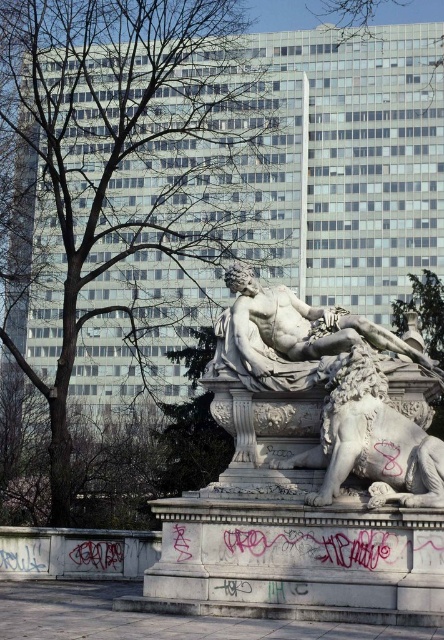
In the scene shown: Is the position of green leafy tree at center more distant than that of white marble statue at center?

Yes, it is behind white marble statue at center.

Who is positioned more to the right, green leafy tree at center or white marble statue at center?

From the viewer's perspective, white marble statue at center appears more on the right side.

Does point (95, 68) lie in front of point (289, 353)?

No, it is not.

Find the location of a particular element. green leafy tree at center is located at coordinates (127, 184).

Does white marble lion at lower center have a greater width compared to white marble statue at center?

Incorrect, white marble lion at lower center's width does not surpass white marble statue at center's.

In the scene shown: Is white marble lion at lower center below white marble statue at center?

Indeed, white marble lion at lower center is positioned under white marble statue at center.

Who is more distant from viewer, (432, 476) or (245, 321)?

Positioned behind is point (245, 321).

Where is `white marble lion at lower center`? white marble lion at lower center is located at coordinates 371,440.

Is green leafy tree at center taller than white marble lion at lower center?

Indeed, green leafy tree at center has a greater height compared to white marble lion at lower center.

Which is more to the left, green leafy tree at center or white marble lion at lower center?

green leafy tree at center

Which is in front, point (71, 3) or point (407, 436)?

Point (407, 436) is in front.

Identify the location of green leafy tree at center. (127, 184).